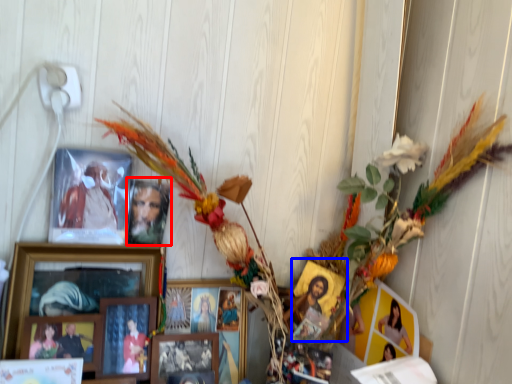
Question: Which of the following is the farthest to the observer, picture frame (highlighted by a red box) or picture frame (highlighted by a blue box)?

Choices:
 (A) picture frame
 (B) picture frame

Answer: (B)